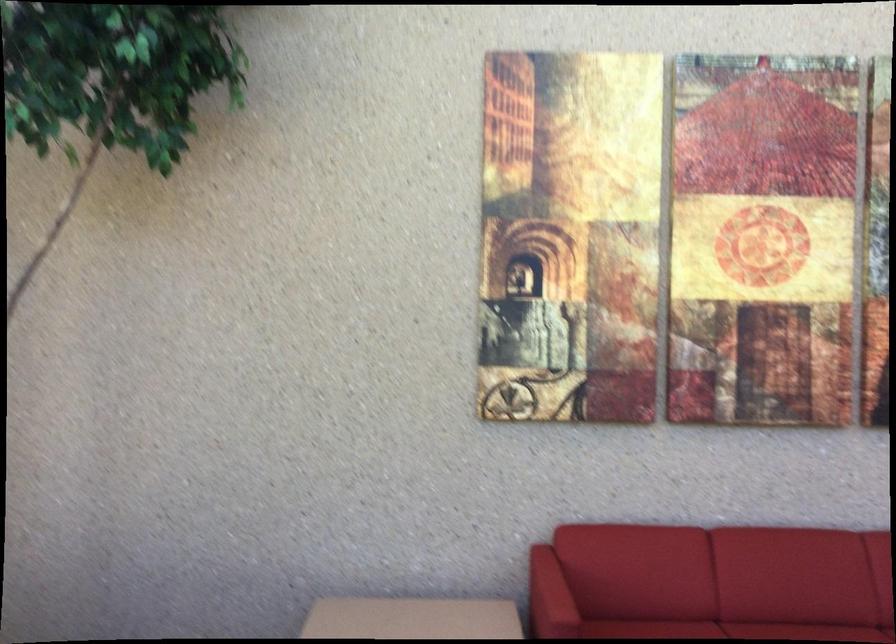
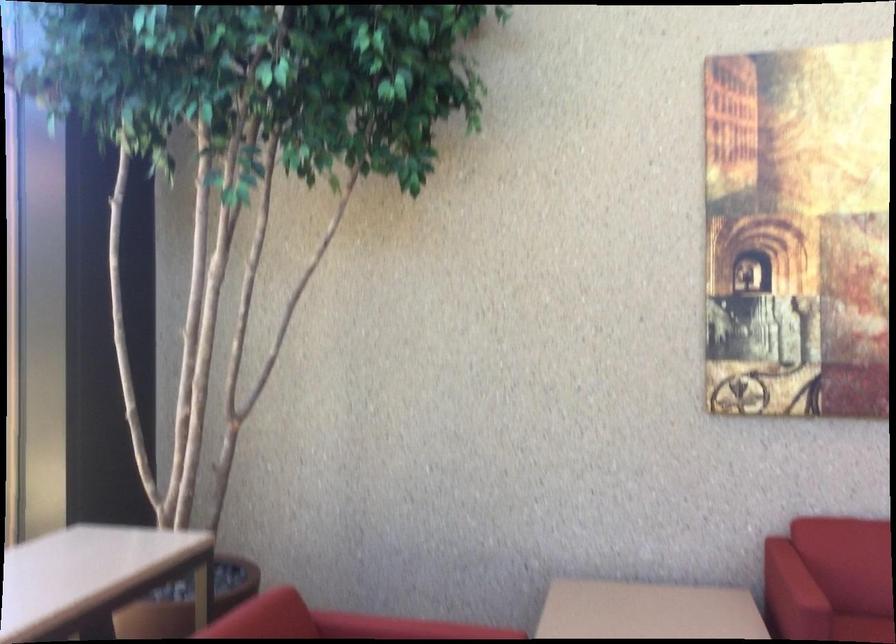
Question: How did the camera likely rotate?

Choices:
 (A) Left
 (B) Right
 (C) Up
 (D) Down

Answer: (A)